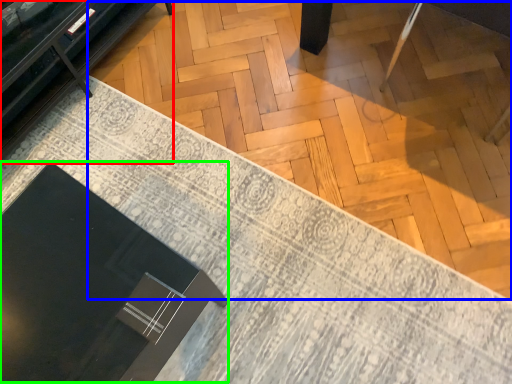
Question: Based on their relative distances, which object is nearer to furniture (highlighted by a red box)? Choose from plywood (highlighted by a blue box) and round table (highlighted by a green box).

Choices:
 (A) plywood
 (B) round table

Answer: (A)